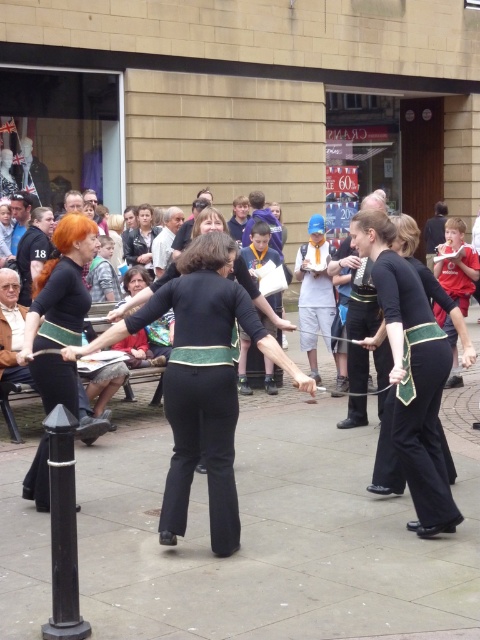
You are a photographer trying to capture a clear photo of both the matte black pants at center and the matte black jacket at center. Which object should you focus on first to ensure both are in focus?

You should focus on the matte black pants at center first because it is closer to the viewer than the matte black jacket at center. By focusing on the closer object, the jacket will also be in focus due to the depth of field.